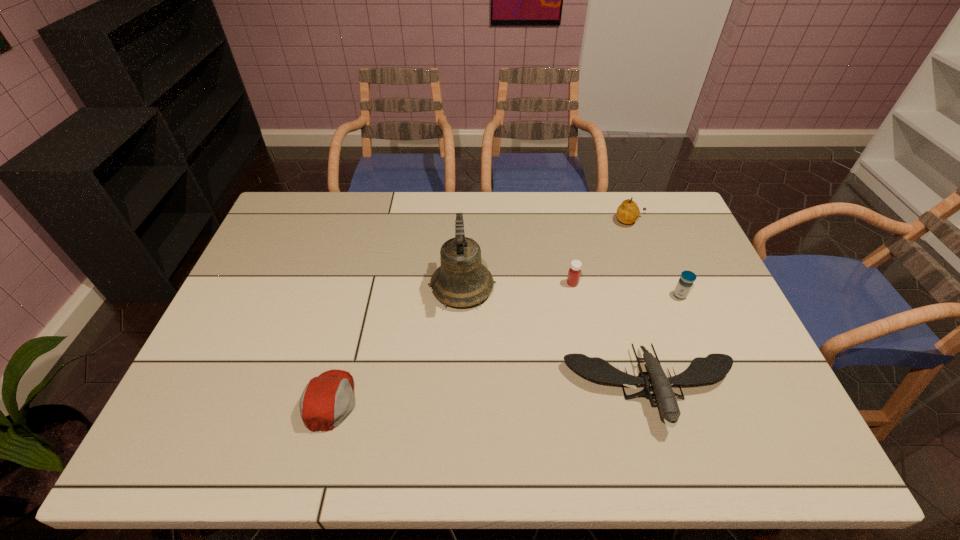
This screenshot has height=540, width=960. Identify the location of bell. (462, 280).

This screenshot has width=960, height=540. Find the location of `the fifth object from right to left`. the fifth object from right to left is located at coordinates (462, 280).

Image resolution: width=960 pixels, height=540 pixels. Identify the location of the second tallest object. (628, 212).

This screenshot has height=540, width=960. Find the location of `the farthest object`. the farthest object is located at coordinates (628, 212).

Image resolution: width=960 pixels, height=540 pixels. I want to click on the farther medicine, so click(x=574, y=272).

I want to click on the right medicine, so click(685, 283).

Identify the location of drone. The height and width of the screenshot is (540, 960). (715, 366).

At what (x,y) coordinates should I click in order to perform the action: click on the leftmost object. Please return your answer as a coordinate pair (x, y). This screenshot has height=540, width=960. Looking at the image, I should click on (328, 399).

Find the location of a particular element. The height and width of the screenshot is (540, 960). vacant area situated 0.070m on the right of the fifth object from right to left is located at coordinates (519, 288).

Locate an element on the screen. vacant space located 0.380m on the front of the fifth shortest object is located at coordinates (664, 314).